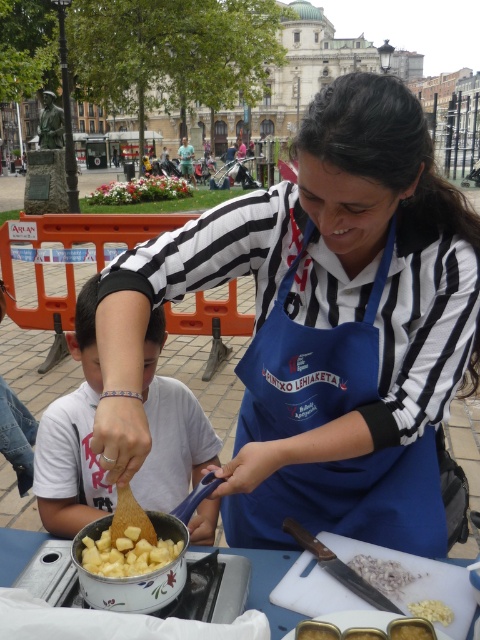
Question: Which point is farther to the camera?

Choices:
 (A) (385, 586)
 (B) (444, 608)
 (C) (347, 291)
 (D) (144, 572)

Answer: (C)

Question: Considering the relative positions of blue fabric apron at center and white crumbly food at lower center in the image provided, where is blue fabric apron at center located with respect to white crumbly food at lower center?

Choices:
 (A) below
 (B) above

Answer: (B)

Question: Which point is farther from the camera taking this photo?

Choices:
 (A) (437, 604)
 (B) (250, 428)
 (C) (83, 548)
 (D) (375, 582)

Answer: (B)

Question: Is white ceramic pot at center to the right of white rubber garlic at center from the viewer's perspective?

Choices:
 (A) yes
 (B) no

Answer: (B)

Question: Observing the image, what is the correct spatial positioning of blue fabric apron at center in reference to white crumbly food at lower center?

Choices:
 (A) below
 (B) above

Answer: (B)

Question: Among these points, which one is farthest from the camera?

Choices:
 (A) (74, 515)
 (B) (21, 541)

Answer: (A)